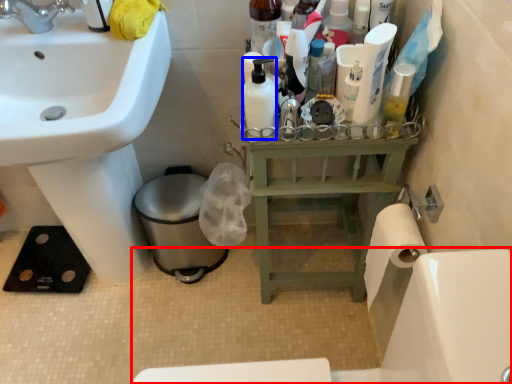
Question: Which of the following is the closest to the observer, bath (highlighted by a red box) or mouthwash (highlighted by a blue box)?

Choices:
 (A) bath
 (B) mouthwash

Answer: (A)